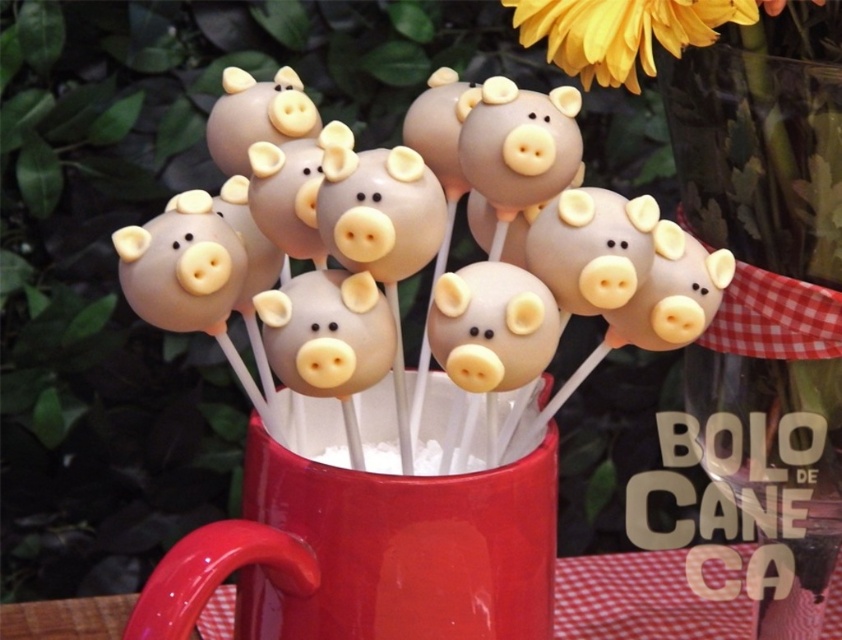
You are a baker who wants to place a yellow matte flower at upper center onto the matte ceramic mug at center. Can you reach the flower from the mug without moving either object?

The matte ceramic mug at center is 22.46 centimeters away from the yellow matte flower at upper center. Since the distance is more than an average person can reach without moving, you cannot reach the flower from the mug without moving either object.

You have a small gift box that needs to be placed either on the matte ceramic mug at center or the yellow matte flower at upper center. Based on their sizes, which object can better accommodate the gift box?

The matte ceramic mug at center has a larger size compared to the yellow matte flower at upper center, so the gift box would fit better on the matte ceramic mug at center.

You are trying to place a small sticker on the matte ceramic mug at center without covering the yellow matte flower at upper center. Is this possible?

The matte ceramic mug at center is in front of the yellow matte flower at upper center, so placing a sticker on the mug might cover the flower if the sticker is large enough. However, if the sticker is small and placed carefully on an area not overlapping the flower, it could be possible.